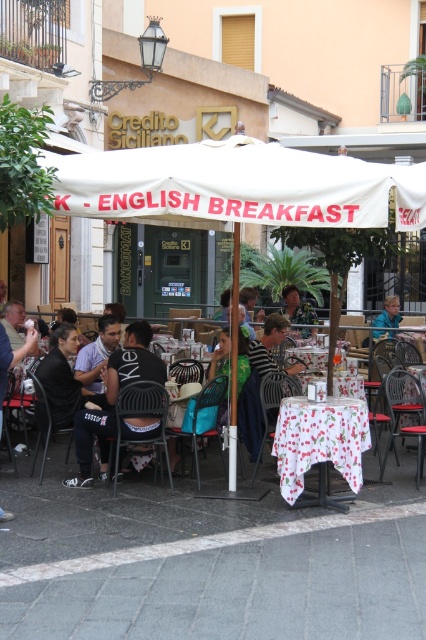
You are standing at the corner of the street where the cafe is located. You want to find the white fabric canopy at center. What are the coordinates of it?

The coordinates of the white fabric canopy at center are at point [236,186].

You are a customer at the outdoor cafe and want to sit between the dark blue shirt at center and the camouflage fabric shirt at center. How far apart are these two shirts?

The dark blue shirt at center is 3.92 meters from the camouflage fabric shirt at center, so the distance between them is 3.92 meters.